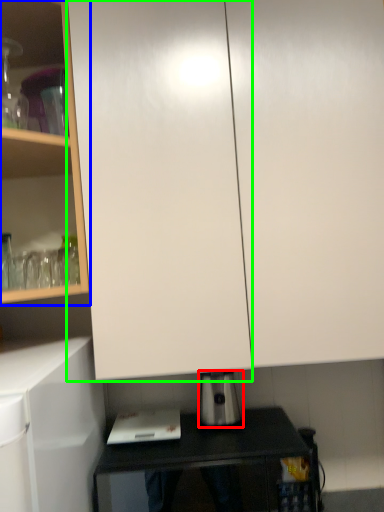
Question: Which is nearer to the kitchen appliance (highlighted by a red box)? cabinetry (highlighted by a blue box) or glass door (highlighted by a green box).

Choices:
 (A) cabinetry
 (B) glass door

Answer: (B)